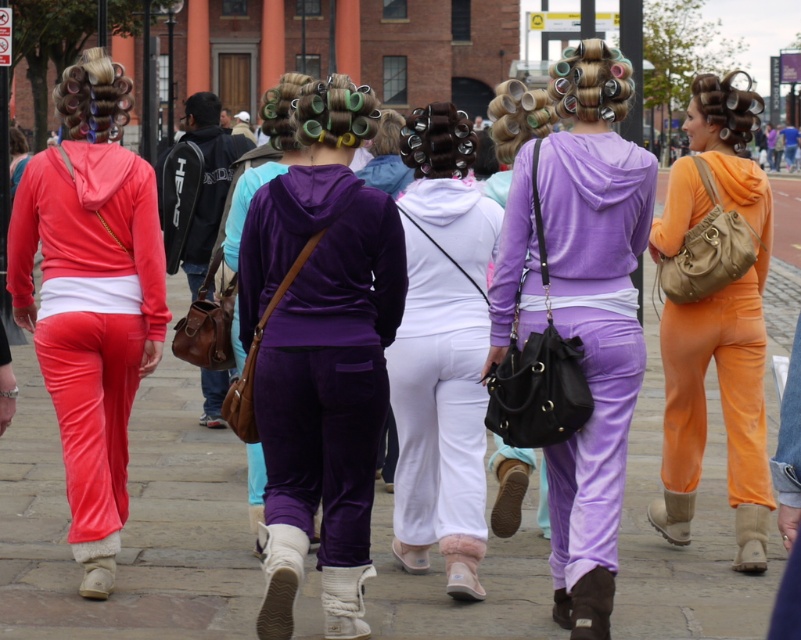
Consider the image. Based on the provided scene description, what is the 2D coordinate of the white matte pants at center?

The white matte pants at center are located at the 2D coordinate point of (441, 352).

You are standing on the matte concrete pavement at center and want to place a small box on the matte velour pants at left. Will the box be visible from your current position?

The matte concrete pavement at center is higher than the matte velour pants at left, so the box placed on the matte velour pants at left will be visible from your position on the matte concrete pavement at center.

Based on the scene description, where is the white matte pants at center located in relation to the purple velvet hoodie at center?

The white matte pants at center are to the right of the purple velvet hoodie at center.